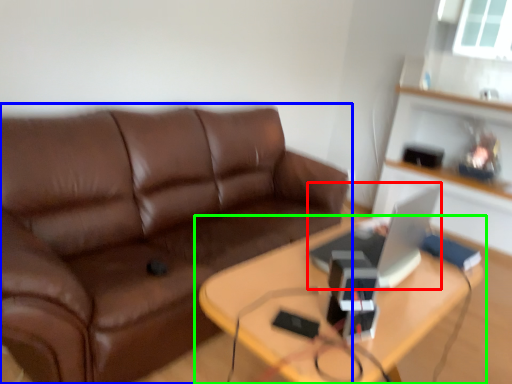
Question: Estimate the real-world distances between objects in this image. Which object is farther from computer (highlighted by a red box), studio couch (highlighted by a blue box) or table (highlighted by a green box)?

Choices:
 (A) studio couch
 (B) table

Answer: (A)